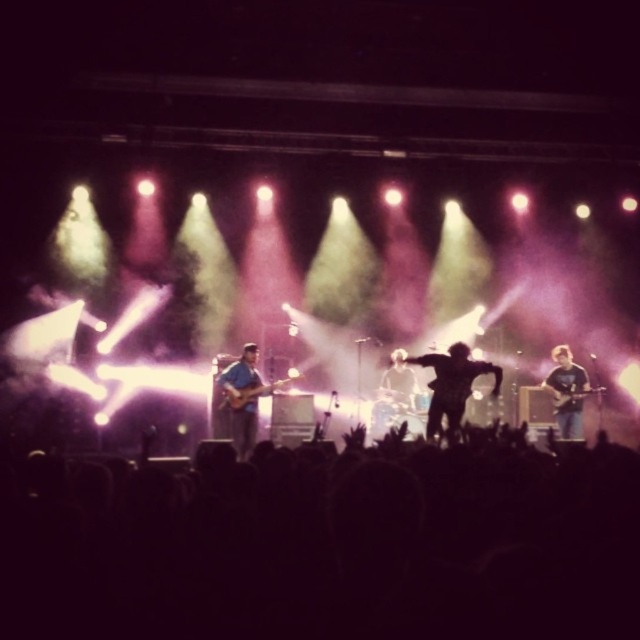
Question: Can you confirm if black silhouettes at lower center is wider than wooden acoustic guitar at right?

Choices:
 (A) yes
 (B) no

Answer: (A)

Question: Can you confirm if dark blue shirt at center is bigger than wooden acoustic guitar at right?

Choices:
 (A) no
 (B) yes

Answer: (B)

Question: Which object is positioned closest to the dark blue shirt at center?

Choices:
 (A) matte blue guitar at center-left
 (B) wooden acoustic guitar at right

Answer: (A)

Question: Which of the following is the farthest from the observer?

Choices:
 (A) click(444, 401)
 (B) click(387, 378)

Answer: (B)

Question: Considering the relative positions of black silhouettes at lower center and matte black guitar at left in the image provided, where is black silhouettes at lower center located with respect to matte black guitar at left?

Choices:
 (A) left
 (B) right

Answer: (B)

Question: Which object is farther from the camera taking this photo?

Choices:
 (A) blue denim jeans at right
 (B) matte blue guitar at center-left
 (C) silhouette figure at center
 (D) dark blue shirt at center

Answer: (D)